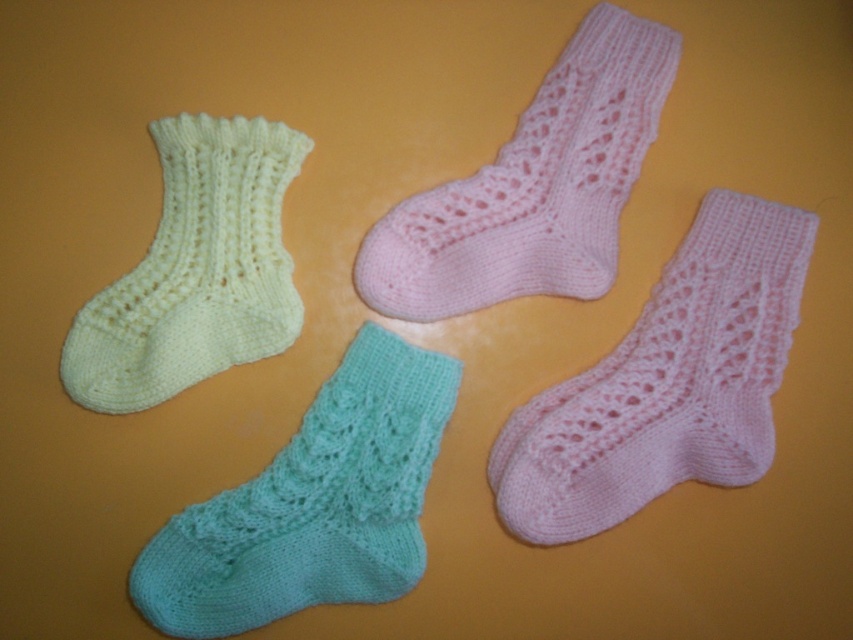
Question: Which point is closer to the camera?

Choices:
 (A) mint green knitted sock at lower left
 (B) pink knitted sock at center
 (C) light yellow knitted sock at left
 (D) pink knitted sock at upper center

Answer: (A)

Question: Is the position of pink knitted sock at upper center more distant than that of light yellow knitted sock at left?

Choices:
 (A) no
 (B) yes

Answer: (B)

Question: Is pink knitted sock at center positioned before pink knitted sock at upper center?

Choices:
 (A) yes
 (B) no

Answer: (A)

Question: Which point is closer to the camera?

Choices:
 (A) (732, 216)
 (B) (448, 280)
 (C) (430, 458)
 (D) (204, 312)

Answer: (D)

Question: Does mint green knitted sock at lower left have a smaller size compared to light yellow knitted sock at left?

Choices:
 (A) no
 (B) yes

Answer: (A)

Question: Which of the following is the farthest from the observer?

Choices:
 (A) (405, 451)
 (B) (86, 348)
 (C) (770, 216)

Answer: (A)